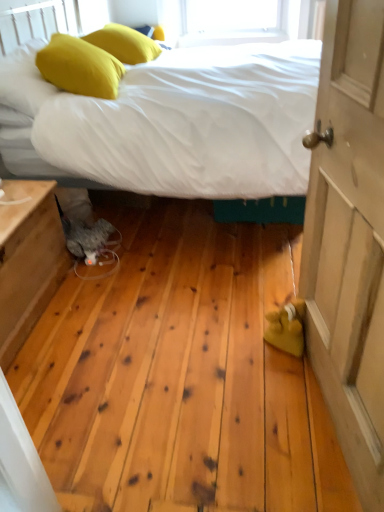
Question: From a real-world perspective, is yellow fabric pillow at upper left, placed as the 2th pillow when sorted from top to bottom, located beneath white fabric bed at center?

Choices:
 (A) no
 (B) yes

Answer: (A)

Question: Can you confirm if yellow fabric pillow at upper left, placed as the 2th pillow when sorted from top to bottom, is thinner than white fabric bed at center?

Choices:
 (A) no
 (B) yes

Answer: (B)

Question: Is yellow fabric pillow at upper left, which is the first pillow in front-to-back order, located outside white fabric bed at center?

Choices:
 (A) no
 (B) yes

Answer: (A)

Question: Is yellow fabric pillow at upper left, which is the first pillow in front-to-back order, further to the viewer compared to white fabric bed at center?

Choices:
 (A) yes
 (B) no

Answer: (A)

Question: From the image's perspective, is yellow fabric pillow at upper left, which appears as the 2th pillow when viewed from the back, on top of white fabric bed at center?

Choices:
 (A) yes
 (B) no

Answer: (A)

Question: From a real-world perspective, is white fabric bed at center physically located above or below wooden door at right?

Choices:
 (A) above
 (B) below

Answer: (B)

Question: Is point (6, 101) closer or farther from the camera than point (317, 157)?

Choices:
 (A) closer
 (B) farther

Answer: (B)

Question: Looking at their shapes, would you say white fabric bed at center is wider or thinner than wooden door at right?

Choices:
 (A) wide
 (B) thin

Answer: (A)

Question: Looking at the image, does white fabric bed at center seem bigger or smaller compared to wooden door at right?

Choices:
 (A) big
 (B) small

Answer: (A)

Question: Is yellow fabric pillow at upper left, marked as the 2th pillow in a bottom-to-top arrangement, wider or thinner than wooden door at right?

Choices:
 (A) wide
 (B) thin

Answer: (A)

Question: Visually, is yellow fabric pillow at upper left, marked as the 2th pillow in a bottom-to-top arrangement, positioned to the left or to the right of wooden door at right?

Choices:
 (A) left
 (B) right

Answer: (A)

Question: Is point pos(100,35) positioned closer to the camera than point pos(372,442)?

Choices:
 (A) farther
 (B) closer

Answer: (A)

Question: Considering the positions of yellow fabric pillow at upper left, marked as the first pillow in a top-to-bottom arrangement, and wooden door at right in the image, is yellow fabric pillow at upper left, marked as the first pillow in a top-to-bottom arrangement, taller or shorter than wooden door at right?

Choices:
 (A) tall
 (B) short

Answer: (B)

Question: From the image's perspective, is wooden nightstand at lower left located above or below yellow fabric pillow at upper left, placed as the 2th pillow when sorted from top to bottom?

Choices:
 (A) above
 (B) below

Answer: (B)

Question: Relative to yellow fabric pillow at upper left, placed as the 2th pillow when sorted from top to bottom, is wooden nightstand at lower left in front or behind?

Choices:
 (A) behind
 (B) front

Answer: (B)